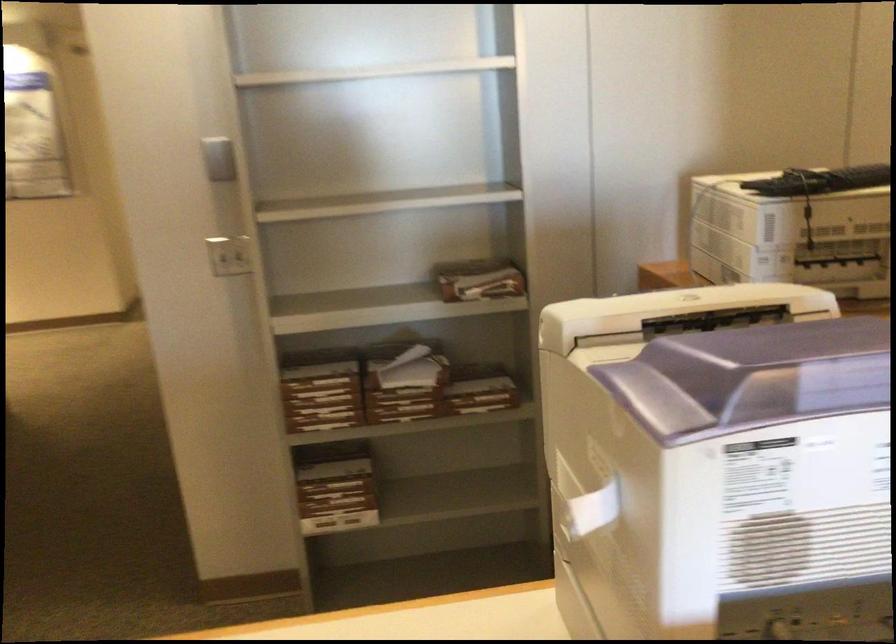
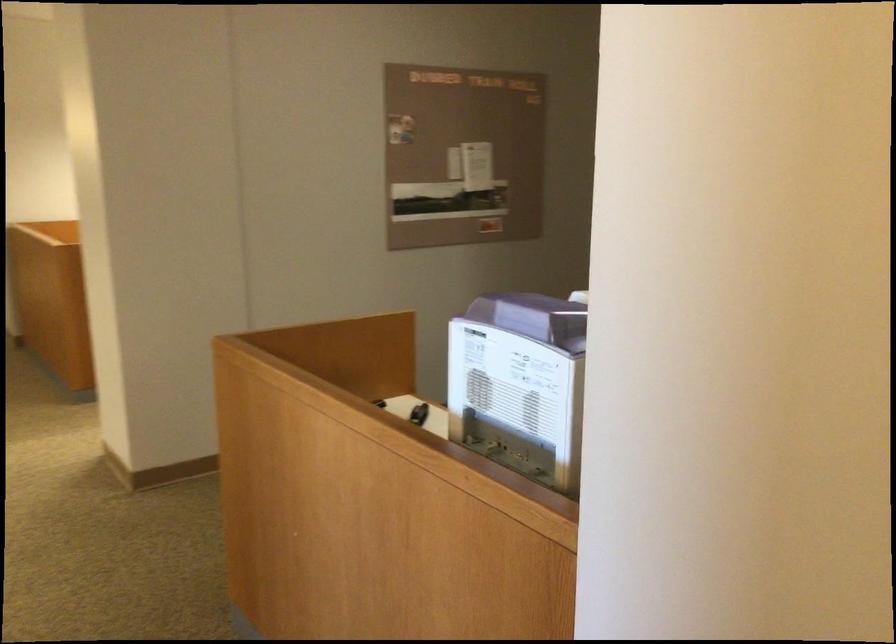
Question: I am providing you with two images of the same scene from different viewpoints. After the viewpoint changes to image2, which objects are now occluded?

Choices:
 (A) stack of files
 (B) purple machine lid
 (C) metal desk hook
 (D) small black object

Answer: (A)